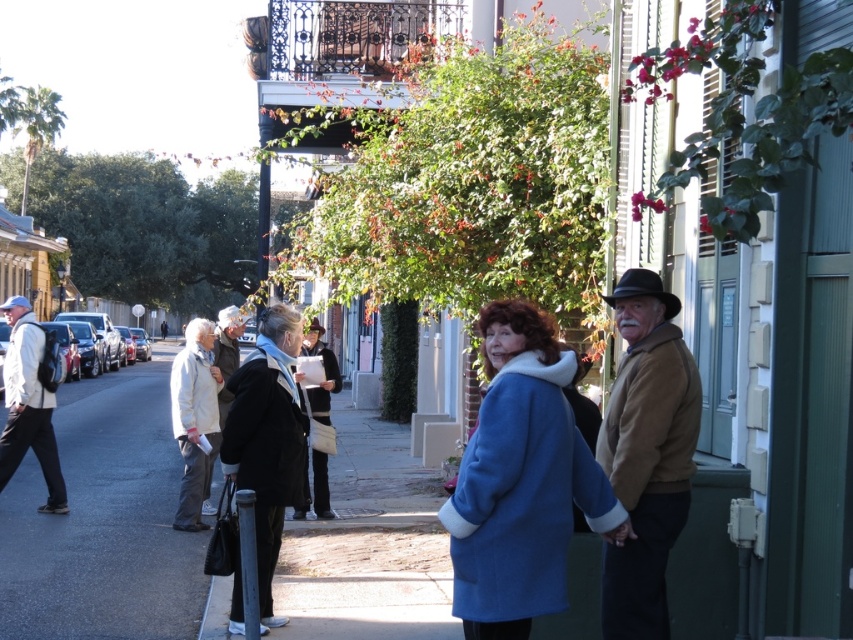
Question: Does black leather coat at center have a smaller size compared to light beige coat at center?

Choices:
 (A) yes
 (B) no

Answer: (A)

Question: Which of the following is the farthest from the observer?

Choices:
 (A) light beige fabric coat at left
 (B) black leather coat at center
 (C) matte black backpack at left

Answer: (B)

Question: Which point appears farthest from the camera in this image?

Choices:
 (A) (264, 401)
 (B) (73, 385)
 (C) (186, 401)

Answer: (B)

Question: Which point is farther to the camera?

Choices:
 (A) (216, 451)
 (B) (676, 435)
 (C) (273, 561)
 (D) (177, 417)

Answer: (A)

Question: Is black leather coat at center positioned behind light beige coat at center?

Choices:
 (A) yes
 (B) no

Answer: (A)

Question: Is brown fuzzy jacket at right below black leather coat at center?

Choices:
 (A) no
 (B) yes

Answer: (A)